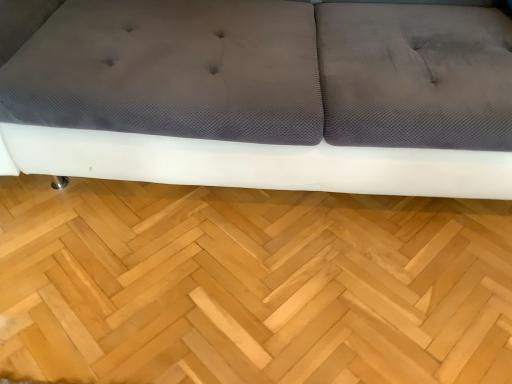
Question: In terms of width, does natural wood floor at center look wider or thinner when compared to matte gray fabric couch at center?

Choices:
 (A) wide
 (B) thin

Answer: (B)

Question: Choose the correct answer: Is natural wood floor at center inside matte gray fabric couch at center or outside it?

Choices:
 (A) outside
 (B) inside

Answer: (A)

Question: Considering their positions, is natural wood floor at center located in front of or behind matte gray fabric couch at center?

Choices:
 (A) front
 (B) behind

Answer: (B)

Question: Do you think matte gray fabric couch at center is within natural wood floor at center, or outside of it?

Choices:
 (A) inside
 (B) outside

Answer: (B)

Question: Visually, is matte gray fabric couch at center positioned to the left or to the right of natural wood floor at center?

Choices:
 (A) right
 (B) left

Answer: (A)

Question: In the image, is matte gray fabric couch at center positioned in front of or behind natural wood floor at center?

Choices:
 (A) front
 (B) behind

Answer: (A)

Question: Does point (274, 61) appear closer or farther from the camera than point (370, 230)?

Choices:
 (A) closer
 (B) farther

Answer: (A)